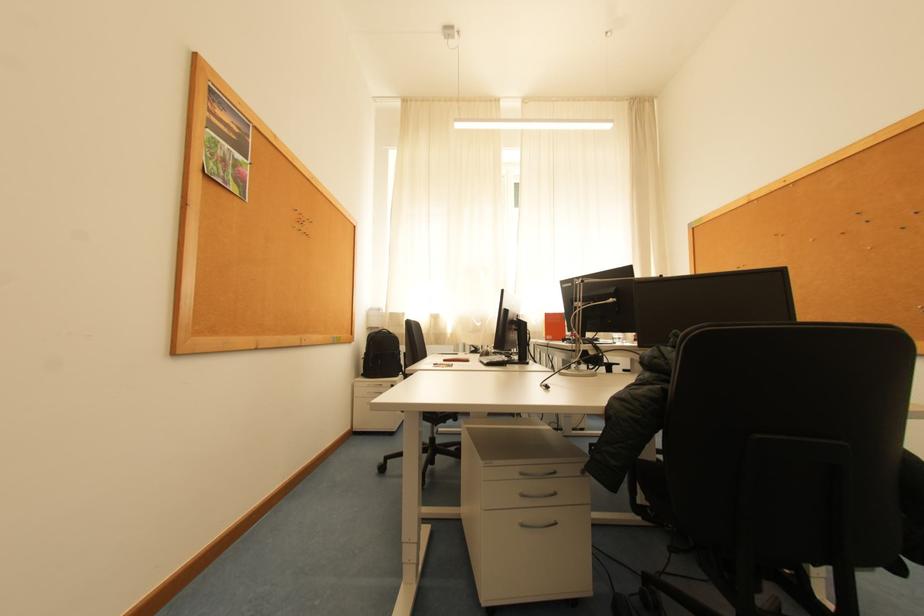
Where is `chair sitting surface`? This screenshot has width=924, height=616. chair sitting surface is located at coordinates (710, 456).